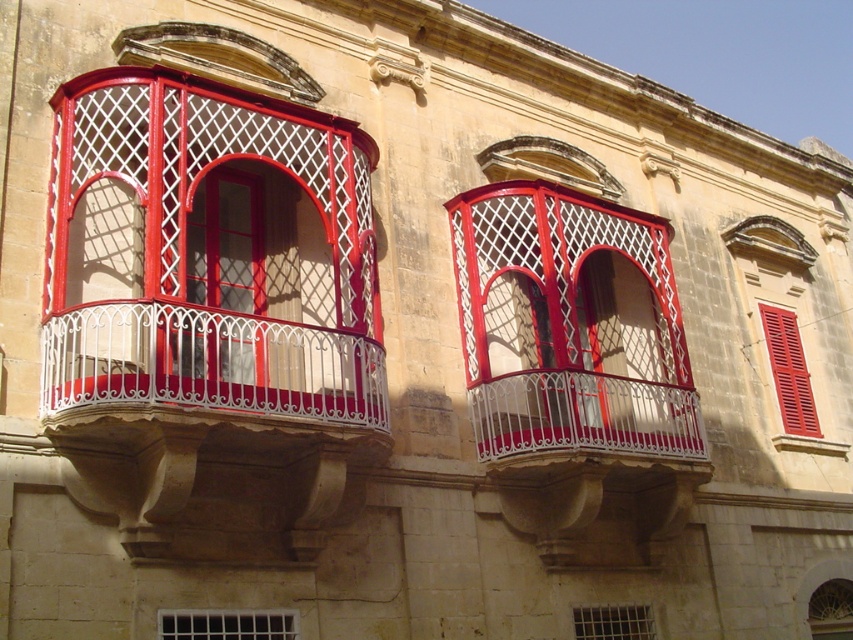
The height and width of the screenshot is (640, 853). In order to click on matte white wrought iron balcony at left in this screenshot , I will do `click(209, 257)`.

Is point (221, 362) behind point (469, 244)?

No.

Which is behind, point (74, 362) or point (610, 324)?

Point (610, 324)

This screenshot has width=853, height=640. I want to click on matte white wrought iron balcony at left, so click(x=209, y=257).

What do you see at coordinates (788, 371) in the screenshot?
I see `matte red shutter at upper right` at bounding box center [788, 371].

Measure the distance between matte red shutter at upper right and camera.

matte red shutter at upper right and camera are 181.92 feet apart.

Where is `matte red shutter at upper right`? This screenshot has width=853, height=640. matte red shutter at upper right is located at coordinates (788, 371).

Does matte white wrought iron balcony at left lie in front of clear glass fan at center?

Yes, matte white wrought iron balcony at left is closer to the viewer.

Based on the photo, can you confirm if matte white wrought iron balcony at left is taller than clear glass fan at center?

Correct, matte white wrought iron balcony at left is much taller as clear glass fan at center.

Is point (90, 340) positioned before point (824, 609)?

That is True.

Find the location of a particular element. This screenshot has width=853, height=640. matte white wrought iron balcony at left is located at coordinates (209, 257).